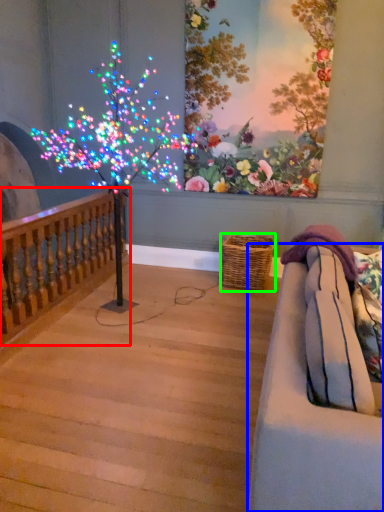
Question: Which is nearer to the rail (highlighted by a red box)? studio couch (highlighted by a blue box) or basket (highlighted by a green box).

Choices:
 (A) studio couch
 (B) basket

Answer: (B)